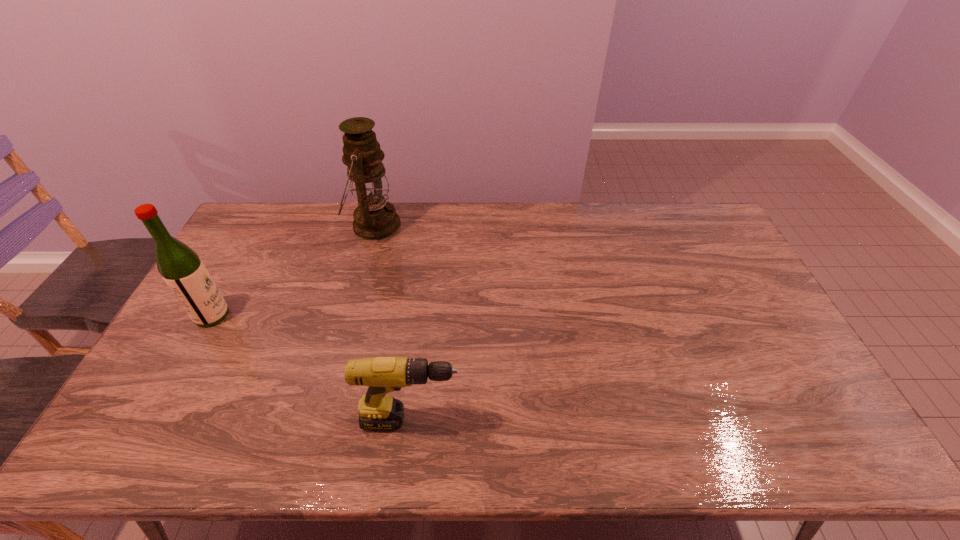
Locate an element on the screen. vacant area between the oil lamp and the leftmost object is located at coordinates (293, 271).

Find the location of a particular element. empty space that is in between the drill and the farthest object is located at coordinates (393, 322).

Locate an element on the screen. This screenshot has height=540, width=960. blank region between the oil lamp and the nearest object is located at coordinates (393, 322).

The image size is (960, 540). Find the location of `empty space between the leftmost object and the second object from left to right`. empty space between the leftmost object and the second object from left to right is located at coordinates (293, 271).

Image resolution: width=960 pixels, height=540 pixels. What are the coordinates of `vacant area between the second object from left to right and the liquor` in the screenshot? It's located at (293, 271).

Image resolution: width=960 pixels, height=540 pixels. What are the coordinates of `free spot between the leftmost object and the shortest object` in the screenshot? It's located at (312, 368).

This screenshot has width=960, height=540. I want to click on the second closest object to the drill, so click(375, 218).

This screenshot has height=540, width=960. Identify the location of the second closest object to the second farthest object. (378, 411).

You are a GUI agent. You are given a task and a screenshot of the screen. Output one action in this format:
    pyautogui.click(x=<x>, y=<y>)
    Task: Click on the vacant space that satisfies the following two spatial constraints: 1. on the front side of the second object from right to left; 2. on the label of the liquor
    The image size is (960, 540).
    Given the screenshot: What is the action you would take?
    pyautogui.click(x=349, y=315)